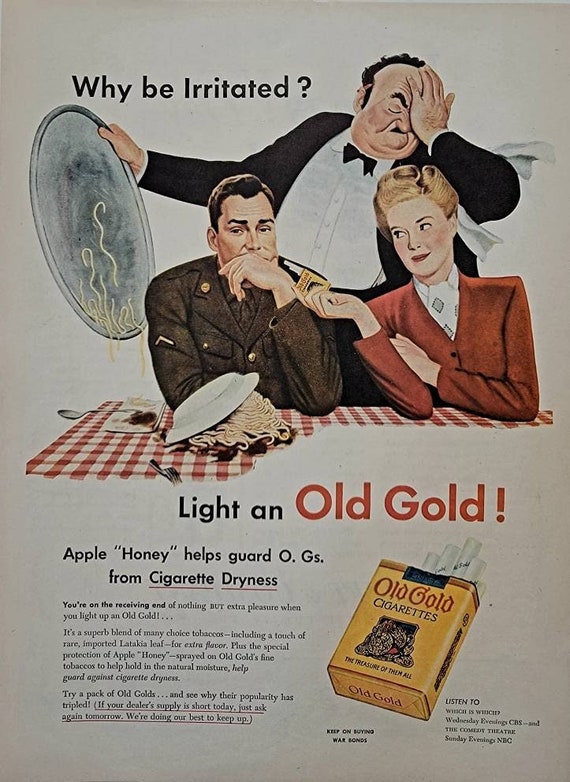
This screenshot has height=782, width=570. In order to click on round empty tray in this screenshot , I will do `click(72, 180)`.